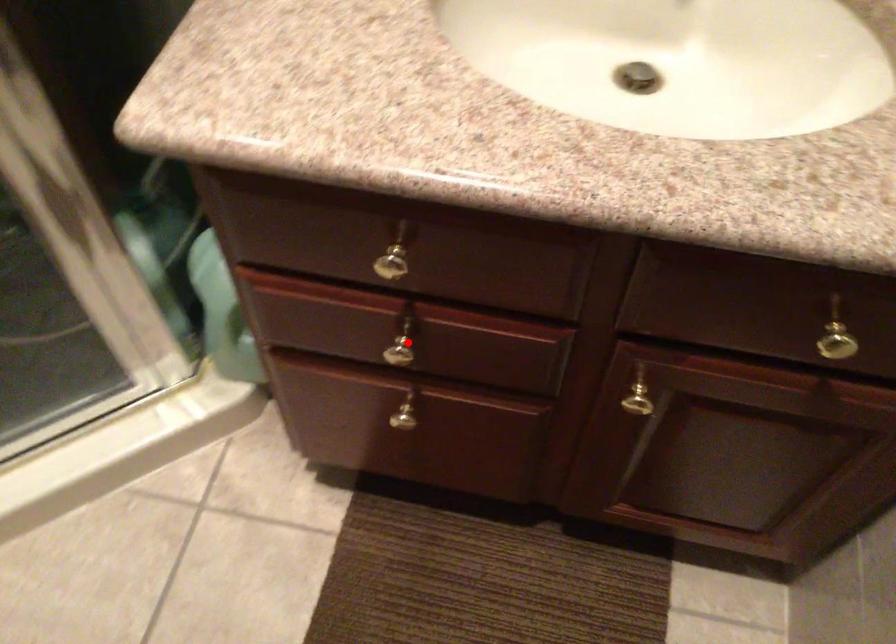
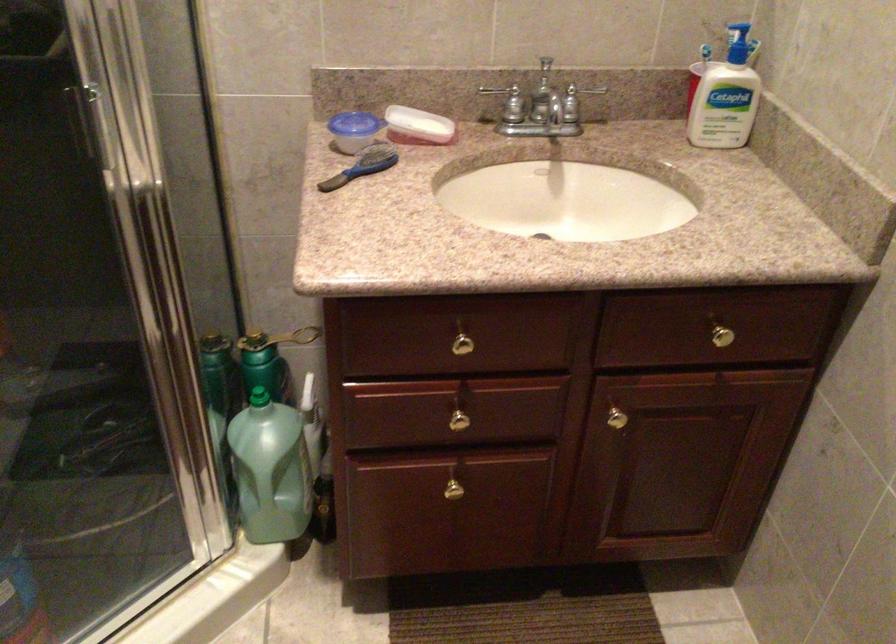
Find the pixel in the second image that matches the highlighted location in the first image.

(459, 415)